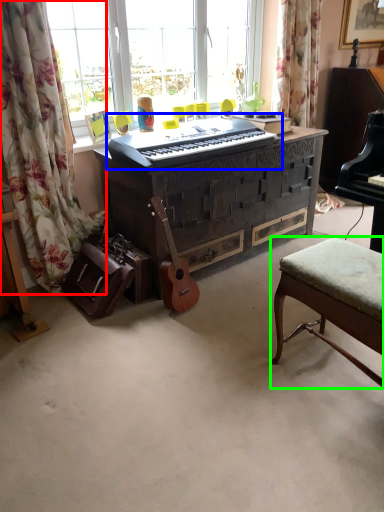
Question: Estimate the real-world distances between objects in this image. Which object is farther from curtain (highlighted by a red box), musical keyboard (highlighted by a blue box) or stool (highlighted by a green box)?

Choices:
 (A) musical keyboard
 (B) stool

Answer: (B)